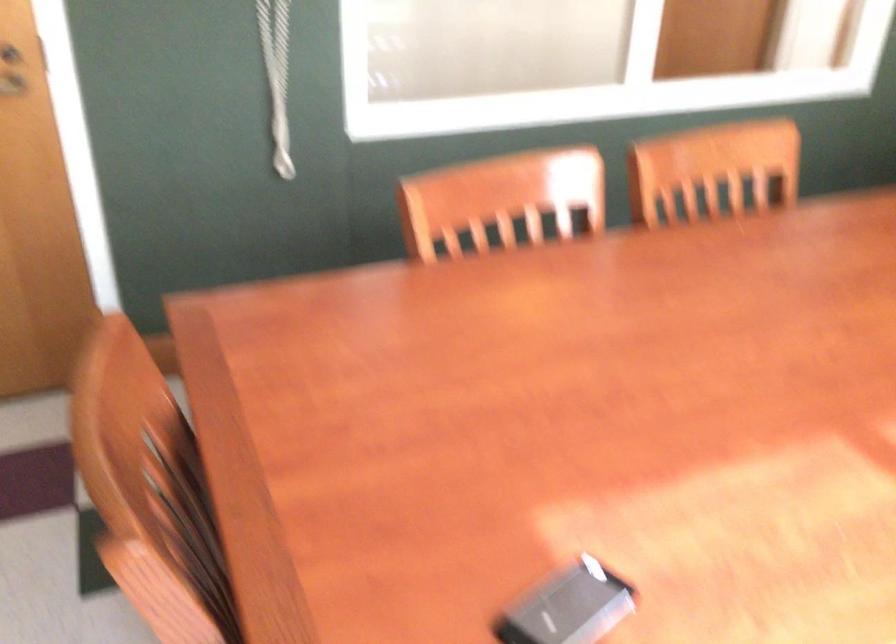
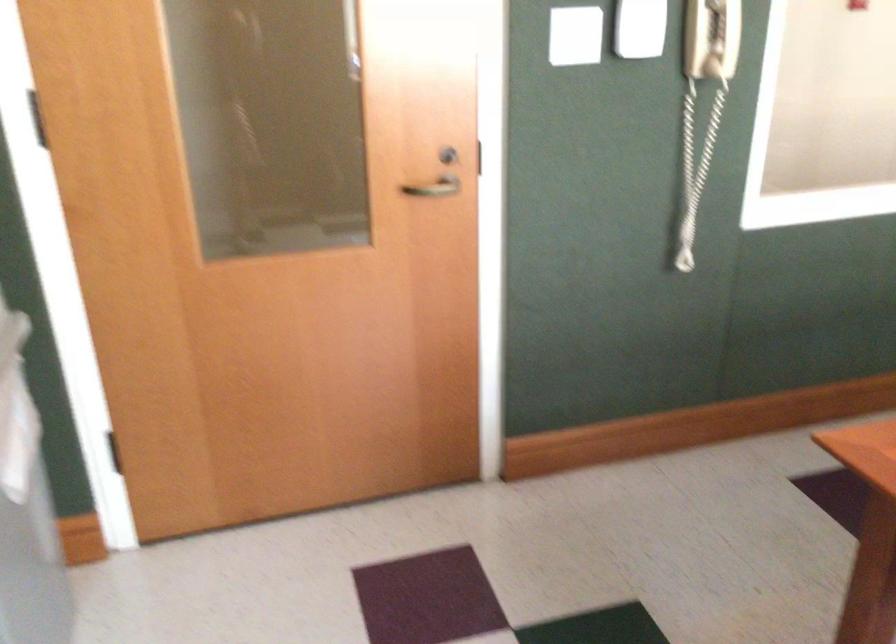
Question: The first image is from the beginning of the video and the second image is from the end. How did the camera likely rotate when shooting the video?

Choices:
 (A) Left
 (B) Right
 (C) Up
 (D) Down

Answer: (A)